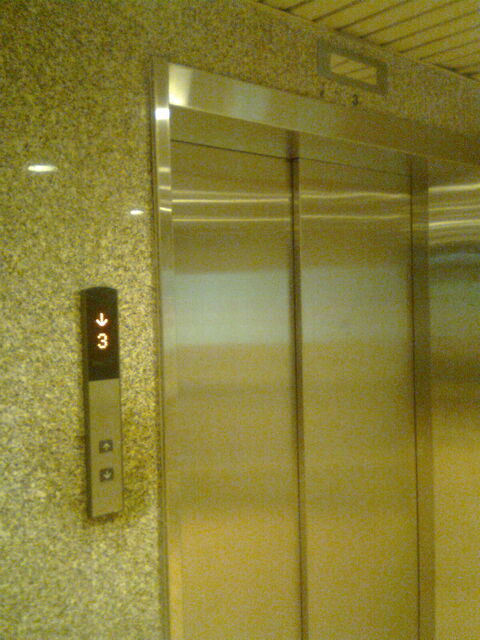
Locate an element on the screen. The width and height of the screenshot is (480, 640). elevator doors is located at coordinates (214, 331), (314, 339).